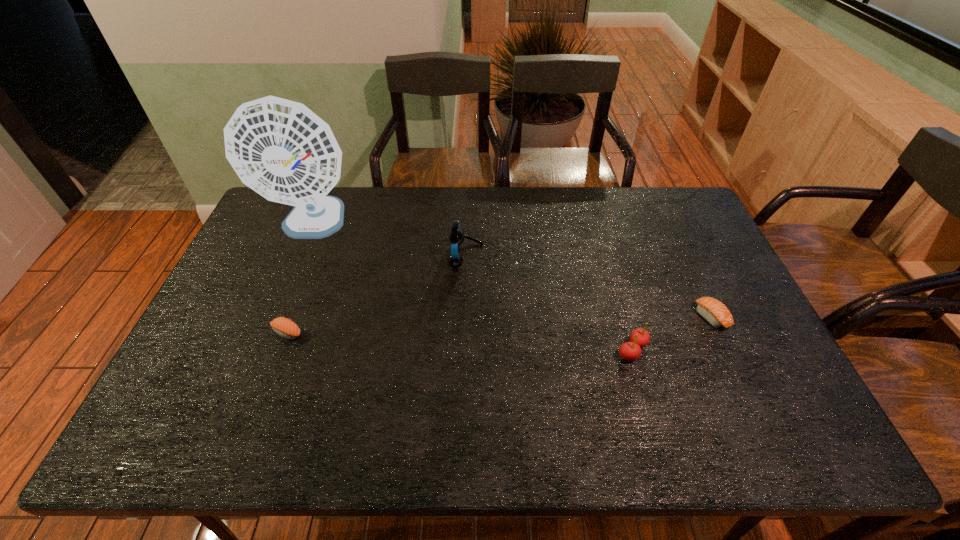
Identify the location of vacant space located 0.310m on the right of the left sushi. (420, 333).

What are the coordinates of `vacant position located 0.390m on the back of the rightmost object` in the screenshot? It's located at (664, 217).

Locate an element on the screen. The image size is (960, 540). object present at the far edge is located at coordinates (279, 148).

Identify the location of object at the left edge. (279, 148).

The width and height of the screenshot is (960, 540). Identify the location of object present at the right edge. (716, 313).

Where is `object that is at the far left corner`? The image size is (960, 540). object that is at the far left corner is located at coordinates (279, 148).

Find the location of a particular element. vacant space at the far edge of the desktop is located at coordinates (465, 190).

Locate an element on the screen. This screenshot has width=960, height=540. free location at the near edge is located at coordinates (422, 451).

Where is `vacant space at the left edge of the desktop`? The width and height of the screenshot is (960, 540). vacant space at the left edge of the desktop is located at coordinates (266, 242).

In the image, there is a desktop. At what (x,y) coordinates should I click in order to perform the action: click on free space at the right edge. Please return your answer as a coordinate pair (x, y). Looking at the image, I should click on (732, 308).